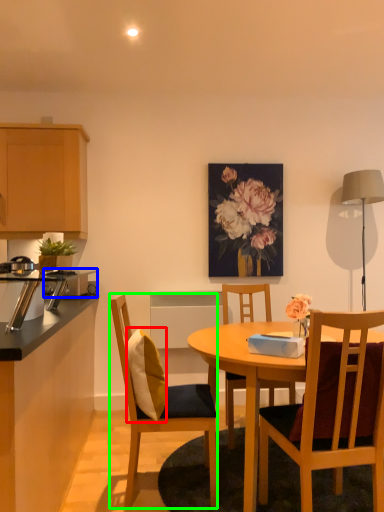
Question: Considering the real-world distances, which object is closest to pillow (highlighted by a red box)? appliance (highlighted by a blue box) or chair (highlighted by a green box).

Choices:
 (A) appliance
 (B) chair

Answer: (B)